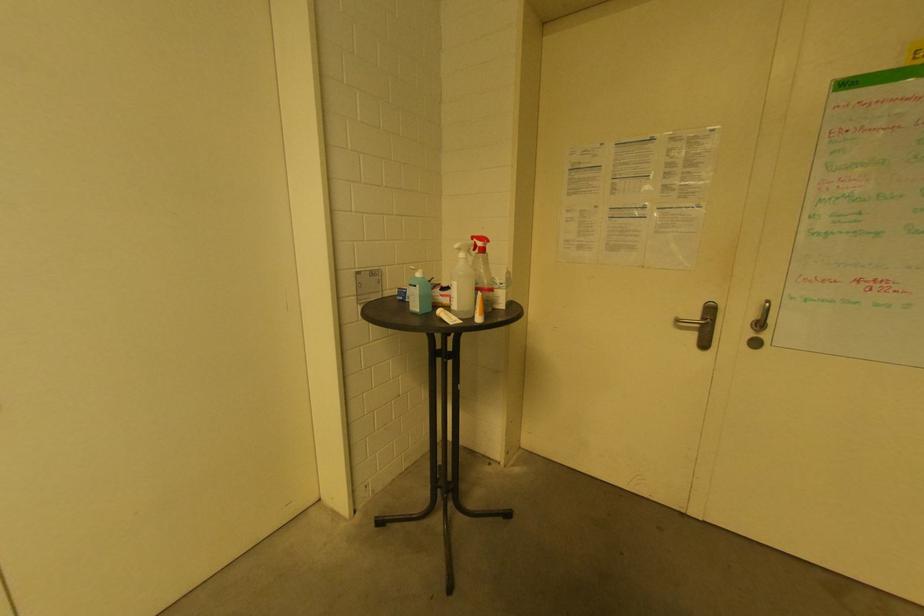
Where would you lift the small white bottle? Please return your answer as a coordinate pair (x, y).

(463, 282)